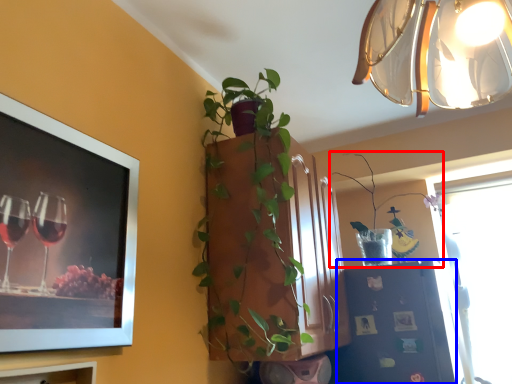
Question: Which object appears farthest to the camera in this image, houseplant (highlighted by a red box) or shelf (highlighted by a blue box)?

Choices:
 (A) houseplant
 (B) shelf

Answer: (A)